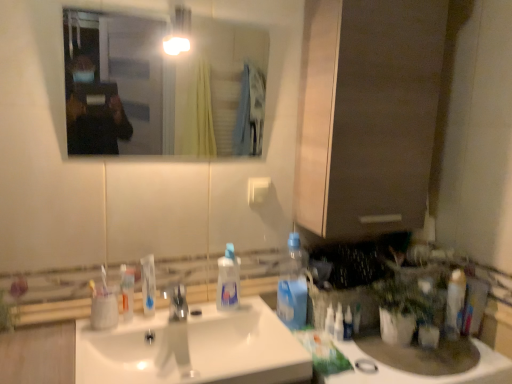
Locate an element on the screen. clear plastic spray bottle at right, placed as the first cleaning product when sorted from right to left is located at coordinates (329, 320).

What is the approximate width of clear plastic spray bottle at right, placed as the first cleaning product when sorted from right to left?

It is 0.89 inches.

Identify the location of matte brown cabinet at center. This screenshot has height=384, width=512. (368, 114).

This screenshot has width=512, height=384. Describe the element at coordinates (93, 288) in the screenshot. I see `white plastic toothbrush at left, marked as the 2th toothbrush in a right-to-left arrangement` at that location.

The image size is (512, 384). In order to click on clear plastic spray bottle at right, placed as the first cleaning product when sorted from right to left in this screenshot , I will do `click(329, 320)`.

Are clear glass mirror at upper center and white plastic light switch at upper center far apart?

clear glass mirror at upper center is positioned a significant distance from white plastic light switch at upper center.

Who is smaller, clear glass mirror at upper center or white plastic light switch at upper center?

Smaller between the two is white plastic light switch at upper center.

Is clear glass mirror at upper center positioned beyond the bounds of white plastic light switch at upper center?

Yes, clear glass mirror at upper center is located beyond the bounds of white plastic light switch at upper center.

In the scene shown: Which is more to the right, clear glass mirror at upper center or white plastic light switch at upper center?

Positioned to the right is white plastic light switch at upper center.

Which of these two, white glossy toothpaste tube at right, placed as the first toiletry when sorted from right to left, or clear plastic spray bottle at right, placed as the first cleaning product when sorted from right to left, is smaller?

Smaller between the two is clear plastic spray bottle at right, placed as the first cleaning product when sorted from right to left.

Could you tell me if white glossy toothpaste tube at right, which ranks as the 2th toiletry in left-to-right order, is facing clear plastic spray bottle at right, placed as the first cleaning product when sorted from right to left?

Result: No, white glossy toothpaste tube at right, which ranks as the 2th toiletry in left-to-right order, does not turn towards clear plastic spray bottle at right, placed as the first cleaning product when sorted from right to left.

Which object is thinner, white glossy toothpaste tube at right, which ranks as the 2th toiletry in left-to-right order, or clear plastic spray bottle at right, which ranks as the third cleaning product in left-to-right order?

clear plastic spray bottle at right, which ranks as the third cleaning product in left-to-right order.

Which is behind, white glossy toothpaste tube at right, placed as the first toiletry when sorted from right to left, or clear plastic spray bottle at right, placed as the first cleaning product when sorted from right to left?

clear plastic spray bottle at right, placed as the first cleaning product when sorted from right to left, is more distant.

Considering the relative sizes of white plastic toothbrush at left, marked as the 2th toothbrush in a right-to-left arrangement, and translucent plastic mouthwash at sink in the image provided, is white plastic toothbrush at left, marked as the 2th toothbrush in a right-to-left arrangement, smaller than translucent plastic mouthwash at sink?

Indeed, white plastic toothbrush at left, marked as the 2th toothbrush in a right-to-left arrangement, has a smaller size compared to translucent plastic mouthwash at sink.

Is white plastic toothbrush at left, the first toothbrush from the left, far from translucent plastic mouthwash at sink?

No.

From the image's perspective, is white plastic toothbrush at left, the first toothbrush from the left, below translucent plastic mouthwash at sink?

Actually, white plastic toothbrush at left, the first toothbrush from the left, appears above translucent plastic mouthwash at sink in the image.

Between white plastic toothbrush at left, marked as the 2th toothbrush in a right-to-left arrangement, and translucent plastic mouthwash at sink, which one is positioned behind?

translucent plastic mouthwash at sink.

Does matte brown cabinet at center lie in front of white plastic toothbrush at left, the 1th toothbrush viewed from the right?

That is True.

In the scene shown: From the image's perspective, is matte brown cabinet at center positioned above or below white plastic toothbrush at left, the 1th toothbrush viewed from the right?

matte brown cabinet at center is above white plastic toothbrush at left, the 1th toothbrush viewed from the right.

Is matte brown cabinet at center far away from white plastic toothbrush at left, the 1th toothbrush viewed from the right?

matte brown cabinet at center is actually quite close to white plastic toothbrush at left, the 1th toothbrush viewed from the right.

Which object is more forward, translucent plastic mouthwash at sink or clear glass mirror at upper center?

clear glass mirror at upper center is more forward.

Does translucent plastic mouthwash at sink have a lesser width compared to clear glass mirror at upper center?

Indeed, translucent plastic mouthwash at sink has a lesser width compared to clear glass mirror at upper center.

Who is bigger, translucent plastic mouthwash at sink or clear glass mirror at upper center?

Bigger between the two is clear glass mirror at upper center.

Consider the image. Would you say translucent plastic mouthwash at sink contains clear glass mirror at upper center?

Definitely not — clear glass mirror at upper center is not inside translucent plastic mouthwash at sink.

Visually, is white glossy counter top at lower right positioned to the left or to the right of matte brown cabinet at center?

In the image, white glossy counter top at lower right appears on the right side of matte brown cabinet at center.

Does white glossy counter top at lower right touch matte brown cabinet at center?

No, white glossy counter top at lower right is not touching matte brown cabinet at center.

Between point (489, 375) and point (385, 55), which one is positioned behind?

The point (385, 55) is behind.

In the image, is white plastic light switch at upper center positioned in front of or behind white glossy counter top at lower right?

In the image, white plastic light switch at upper center appears behind white glossy counter top at lower right.

Does point (265, 186) come farther from viewer compared to point (478, 340)?

Yes, point (265, 186) is behind point (478, 340).

Looking at this image, between white plastic light switch at upper center and white glossy counter top at lower right, which one has more height?

white glossy counter top at lower right.

Could you tell me if white plastic light switch at upper center is facing white glossy counter top at lower right?

No.

The image size is (512, 384). What are the coordinates of `mirror that is above the white plastic light switch at upper center (from the image's perspective)` in the screenshot? It's located at (163, 86).

The image size is (512, 384). In order to click on the 1st cleaning product to the left of the white glossy toothpaste tube at right, which ranks as the 2th toiletry in left-to-right order, counting from the anchor's position in this screenshot , I will do `click(329, 320)`.

Considering their positions, is clear glass mirror at upper center positioned closer to blue plastic bottle at center-right, which is the second cleaning product in left-to-right order, than white plastic toothbrush at left, the 2th toothbrush when ordered from left to right?

white plastic toothbrush at left, the 2th toothbrush when ordered from left to right, lies closer to blue plastic bottle at center-right, which is the second cleaning product in left-to-right order, than the other object.

Estimate the real-world distances between objects in this image. Which object is closer to white plastic light switch at upper center, white plastic toothbrush at left, the first toothbrush from the left, or white plastic toothbrush at left, the 2th toothbrush when ordered from left to right?

white plastic toothbrush at left, the 2th toothbrush when ordered from left to right.

Looking at this image, when comparing their distances from blue plastic bottle at center-right, marked as the second cleaning product in a right-to-left arrangement, does white glossy sink at center or white plastic toothbrush at left, the 1th toothbrush viewed from the right, seem closer?

white glossy sink at center is positioned closer to the anchor blue plastic bottle at center-right, marked as the second cleaning product in a right-to-left arrangement.

Based on their spatial positions, is transparent plastic spray bottle at center, the third cleaning product when ordered from right to left, or white glossy sink at center closer to white plastic toothbrush at left, the first toothbrush from the left?

white glossy sink at center.

Estimate the real-world distances between objects in this image. Which object is further from clear plastic spray bottle at right, which ranks as the third cleaning product in left-to-right order, white glossy toothpaste at center or blue plastic bottle at center-right, marked as the second cleaning product in a right-to-left arrangement?

white glossy toothpaste at center.

When comparing their distances from white plastic light switch at upper center, does blue plastic bottle at center-right, which is the second cleaning product in left-to-right order, or clear glass mirror at upper center seem further?

The object further to white plastic light switch at upper center is clear glass mirror at upper center.

When comparing their distances from translucent plastic mouthwash at sink, does transparent plastic spray bottle at center, the third cleaning product when ordered from right to left, or blue plastic bottle at center-right, marked as the second cleaning product in a right-to-left arrangement, seem further?

blue plastic bottle at center-right, marked as the second cleaning product in a right-to-left arrangement, is positioned further to the anchor translucent plastic mouthwash at sink.

In the scene shown: From the image, which object appears to be nearer to white plastic toothbrush at left, marked as the 2th toothbrush in a right-to-left arrangement, white glossy toothpaste at center or white glossy toothpaste tube at right, placed as the first toiletry when sorted from right to left?

white glossy toothpaste at center.

Image resolution: width=512 pixels, height=384 pixels. I want to click on mirror situated between white plastic toothbrush at left, the 1th toothbrush viewed from the right, and matte brown cabinet at center from left to right, so click(x=163, y=86).

Identify the location of toothpaste located between translucent plastic mouthwash at sink and clear plastic spray bottle at right, which ranks as the third cleaning product in left-to-right order, in the left-right direction. (148, 284).

The image size is (512, 384). I want to click on mirror between translucent plastic mouthwash at sink and white glossy toothpaste tube at right, placed as the first toiletry when sorted from right to left, so click(x=163, y=86).

Where is `cleaning product between matte brown cabinet at center and blue plastic bottle at center-right, marked as the second cleaning product in a right-to-left arrangement, in the vertical direction`? This screenshot has height=384, width=512. cleaning product between matte brown cabinet at center and blue plastic bottle at center-right, marked as the second cleaning product in a right-to-left arrangement, in the vertical direction is located at coordinates (228, 281).